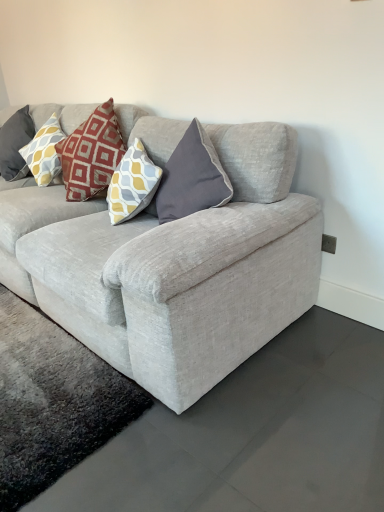
Question: Does yellow and gray patterned pillow at upper left lie behind textured gray couch at center?

Choices:
 (A) no
 (B) yes

Answer: (B)

Question: Can we say yellow and gray patterned pillow at upper left lies outside textured gray couch at center?

Choices:
 (A) no
 (B) yes

Answer: (A)

Question: Does yellow and gray patterned pillow at upper left have a lesser width compared to textured gray couch at center?

Choices:
 (A) yes
 (B) no

Answer: (A)

Question: Considering the relative sizes of yellow and gray patterned pillow at upper left and textured gray couch at center in the image provided, is yellow and gray patterned pillow at upper left taller than textured gray couch at center?

Choices:
 (A) no
 (B) yes

Answer: (A)

Question: Is yellow and gray patterned pillow at upper left aimed at textured gray couch at center?

Choices:
 (A) yes
 (B) no

Answer: (A)

Question: From a real-world perspective, is yellow and gray patterned pillow at upper left below textured gray couch at center?

Choices:
 (A) no
 (B) yes

Answer: (A)

Question: Considering the relative sizes of textured gray couch at center and yellow and gray patterned pillow at upper left in the image provided, is textured gray couch at center smaller than yellow and gray patterned pillow at upper left?

Choices:
 (A) yes
 (B) no

Answer: (B)

Question: Is textured gray couch at center at the right side of yellow and gray patterned pillow at upper left?

Choices:
 (A) yes
 (B) no

Answer: (A)

Question: Are textured gray couch at center and yellow and gray patterned pillow at upper left located far from each other?

Choices:
 (A) no
 (B) yes

Answer: (B)

Question: Considering the relative sizes of textured gray couch at center and yellow and gray patterned pillow at upper left in the image provided, is textured gray couch at center thinner than yellow and gray patterned pillow at upper left?

Choices:
 (A) no
 (B) yes

Answer: (A)

Question: From a real-world perspective, does textured gray couch at center sit lower than yellow and gray patterned pillow at upper left?

Choices:
 (A) no
 (B) yes

Answer: (B)

Question: Does textured gray couch at center have a lesser height compared to yellow and gray patterned pillow at upper left?

Choices:
 (A) no
 (B) yes

Answer: (A)

Question: Considering the positions of yellow and gray patterned pillow at upper left and textured gray couch at center in the image, is yellow and gray patterned pillow at upper left bigger or smaller than textured gray couch at center?

Choices:
 (A) big
 (B) small

Answer: (B)